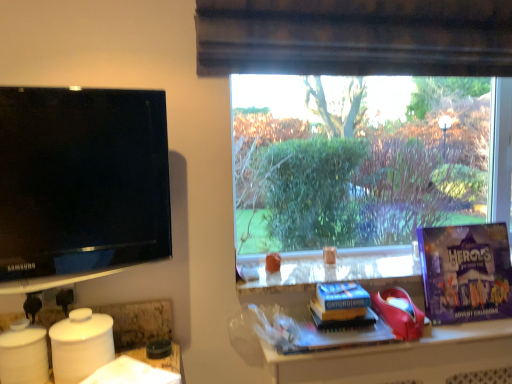
Where is `free space to the left of yellow matte book at center, the first book in the top-to-bottom sequence`? The width and height of the screenshot is (512, 384). free space to the left of yellow matte book at center, the first book in the top-to-bottom sequence is located at coordinates (301, 329).